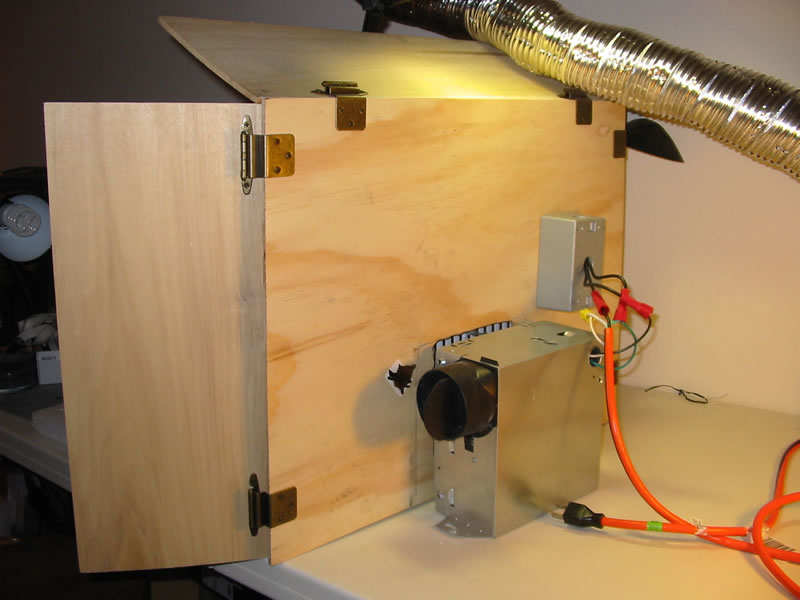
Where is `hinge`? hinge is located at coordinates (273, 154), (338, 99), (266, 517), (582, 105), (620, 146), (618, 366).